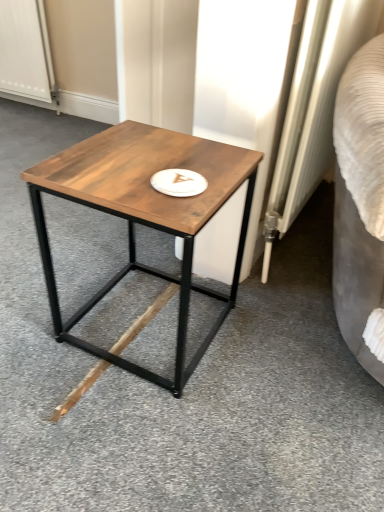
You are a GUI agent. You are given a task and a screenshot of the screen. Output one action in this format:
    pyautogui.click(x=<x>, y=<y>)
    Task: Click on the vacant space positioned to the left of white matte platter at center
    This screenshot has width=384, height=512.
    Given the screenshot: What is the action you would take?
    pyautogui.click(x=104, y=175)